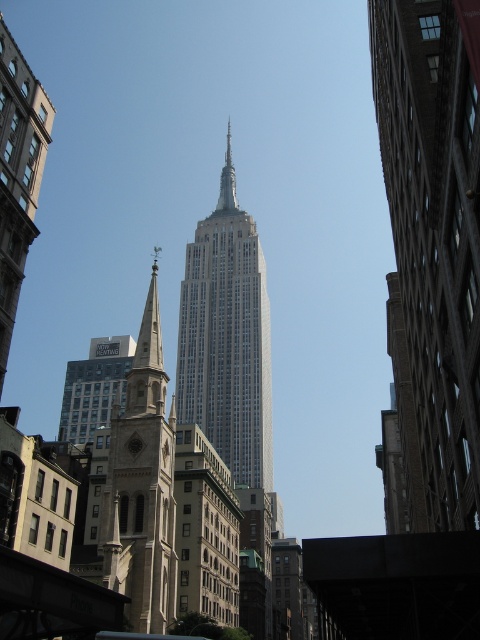
You are an architect analyzing the skyline of this cityscape. You notice the light brown stone church steeple at left and the silver metallic spire at center. Which of these two structures appears taller in the image?

The light brown stone church steeple at left is much taller than the silver metallic spire at center, so it appears taller in the image.

You are standing on the sidewalk in front of the Empire State Building and see the light brown stone church steeple at left and the silver metallic spire at center. Which one is closer to the ground?

The light brown stone church steeple at left is below the silver metallic spire at center, so it is closer to the ground.

You are an architect analyzing the skyline of this urban scene. Which object, the smooth stone tower at left or the silver metallic spire at center, would you say is taller based on their visual proportions?

The smooth stone tower at left is smaller than the silver metallic spire at center, so the silver metallic spire at center is taller.